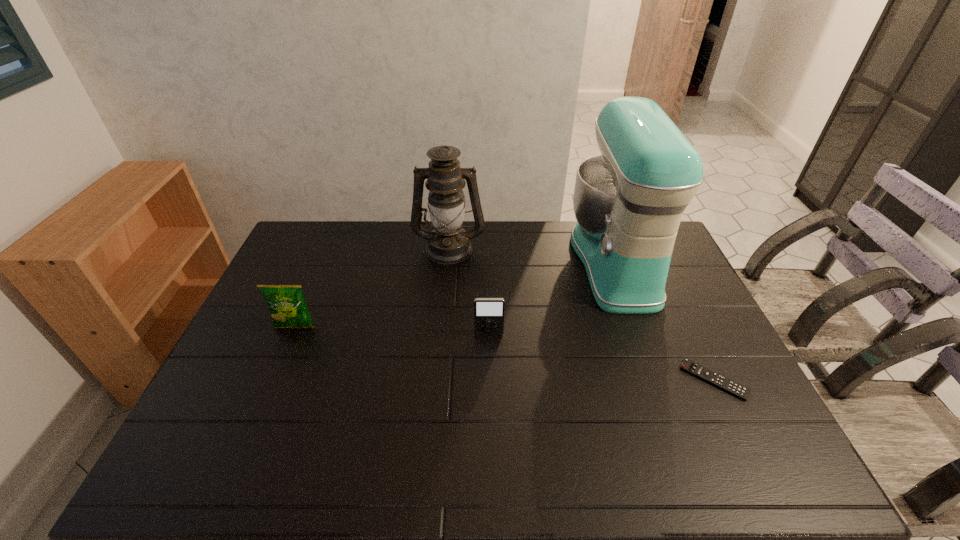
At what (x,y) coordinates should I click in order to perform the action: click on the tallest object. Please return your answer as a coordinate pair (x, y). This screenshot has width=960, height=540. Looking at the image, I should click on (x=628, y=201).

Where is `oil lamp`? This screenshot has width=960, height=540. oil lamp is located at coordinates (448, 243).

At what (x,y) coordinates should I click in order to perform the action: click on the leftmost object. Please return your answer as a coordinate pair (x, y). This screenshot has height=540, width=960. Looking at the image, I should click on (288, 308).

The height and width of the screenshot is (540, 960). Identify the location of crisp (potato chip). (288, 308).

Where is `the second shortest object`? the second shortest object is located at coordinates (489, 313).

The width and height of the screenshot is (960, 540). I want to click on the nearest object, so click(689, 366).

Find the location of a particular element. Image resolution: width=960 pixels, height=540 pixels. remote control is located at coordinates (689, 366).

Locate an element on the screen. free space located 0.270m at the base of the mixer is located at coordinates (494, 262).

Where is `vacant space located 0.140m at the base of the mixer`? This screenshot has height=540, width=960. vacant space located 0.140m at the base of the mixer is located at coordinates (531, 262).

Find the location of a particular element. vacant position located 0.070m at the base of the mixer is located at coordinates (551, 262).